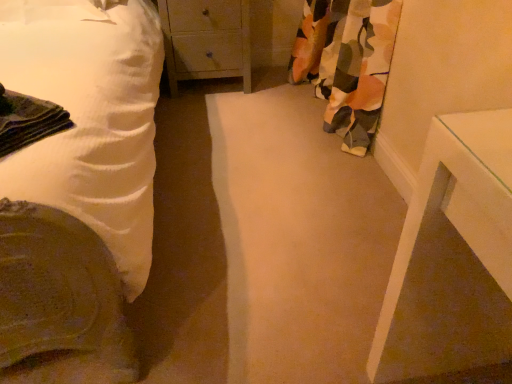
Question: Considering the relative sizes of wooden chest of drawers at center and floral fabric curtain at right in the image provided, is wooden chest of drawers at center thinner than floral fabric curtain at right?

Choices:
 (A) yes
 (B) no

Answer: (B)

Question: Is wooden chest of drawers at center wider than floral fabric curtain at right?

Choices:
 (A) no
 (B) yes

Answer: (B)

Question: From a real-world perspective, does wooden chest of drawers at center sit lower than floral fabric curtain at right?

Choices:
 (A) no
 (B) yes

Answer: (B)

Question: Is wooden chest of drawers at center to the right of floral fabric curtain at right from the viewer's perspective?

Choices:
 (A) yes
 (B) no

Answer: (B)

Question: Is the position of wooden chest of drawers at center less distant than that of floral fabric curtain at right?

Choices:
 (A) no
 (B) yes

Answer: (A)

Question: Can you confirm if wooden chest of drawers at center is positioned to the left of floral fabric curtain at right?

Choices:
 (A) no
 (B) yes

Answer: (B)

Question: From the image's perspective, is white cotton bed at left located beneath wooden chest of drawers at center?

Choices:
 (A) yes
 (B) no

Answer: (A)

Question: Is white cotton bed at left thinner than wooden chest of drawers at center?

Choices:
 (A) no
 (B) yes

Answer: (A)

Question: From a real-world perspective, is white cotton bed at left positioned over wooden chest of drawers at center based on gravity?

Choices:
 (A) no
 (B) yes

Answer: (B)

Question: Is white cotton bed at left oriented towards wooden chest of drawers at center?

Choices:
 (A) no
 (B) yes

Answer: (A)

Question: Does white cotton bed at left lie behind wooden chest of drawers at center?

Choices:
 (A) no
 (B) yes

Answer: (A)

Question: Can you confirm if white cotton bed at left is positioned to the left of wooden chest of drawers at center?

Choices:
 (A) yes
 (B) no

Answer: (A)

Question: Does floral fabric curtain at right have a greater height compared to white cotton bed at left?

Choices:
 (A) yes
 (B) no

Answer: (B)